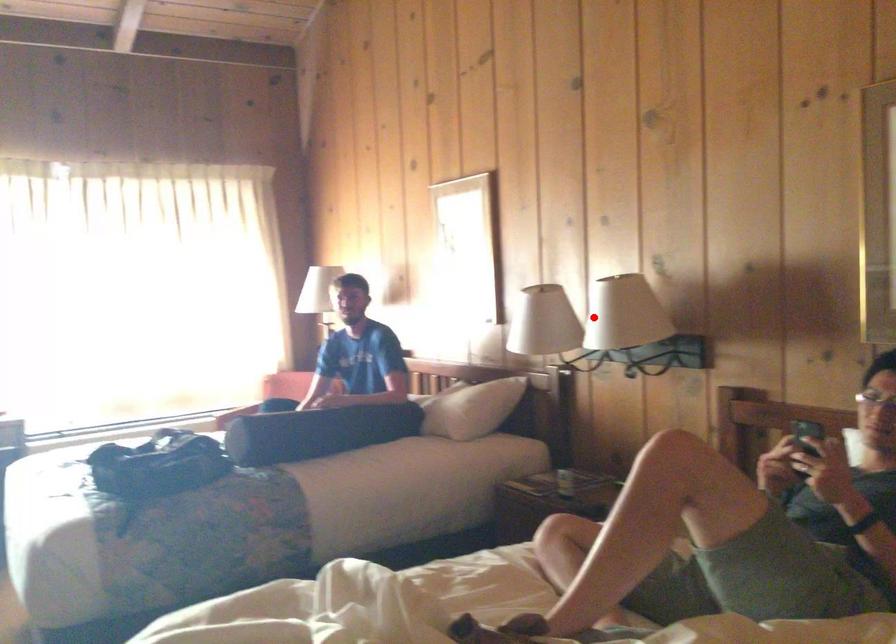
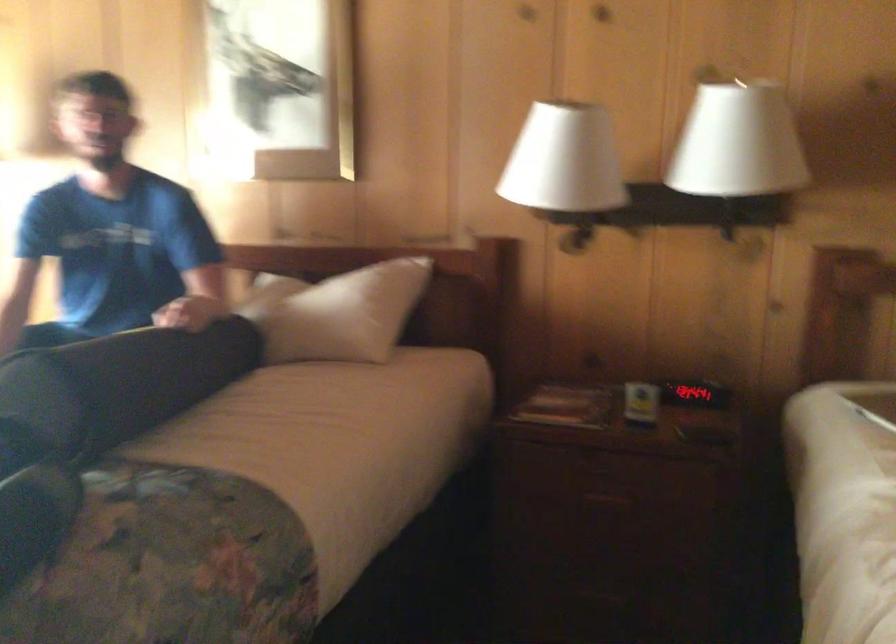
Question: I am providing you with two images of the same scene from different viewpoints. A red point is marked on the first image. At the location where the point appears in image 1, is it still visible in image 2?

Choices:
 (A) Yes
 (B) No

Answer: (A)